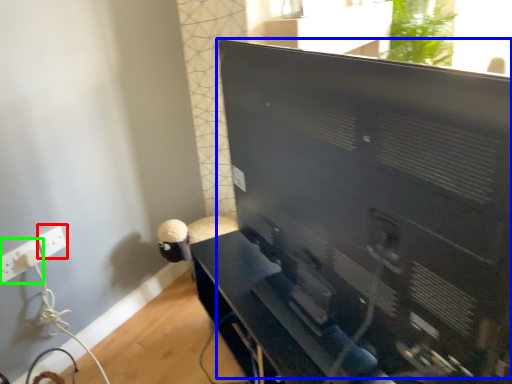
Question: Based on their relative distances, which object is nearer to electric outlet (highlighted by a red box)? Choose from computer monitor (highlighted by a blue box) and electric outlet (highlighted by a green box).

Choices:
 (A) computer monitor
 (B) electric outlet

Answer: (B)